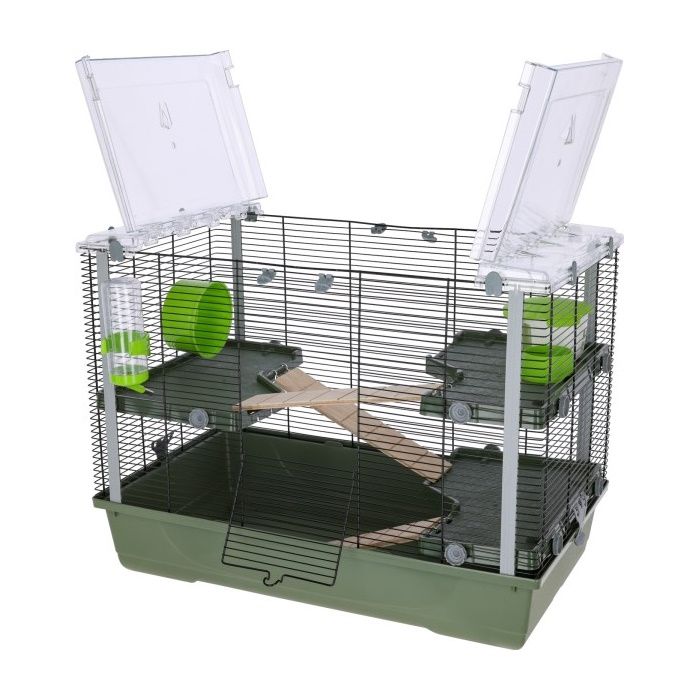
Locate an element on the screen. This screenshot has height=700, width=700. green trim is located at coordinates (480, 617).